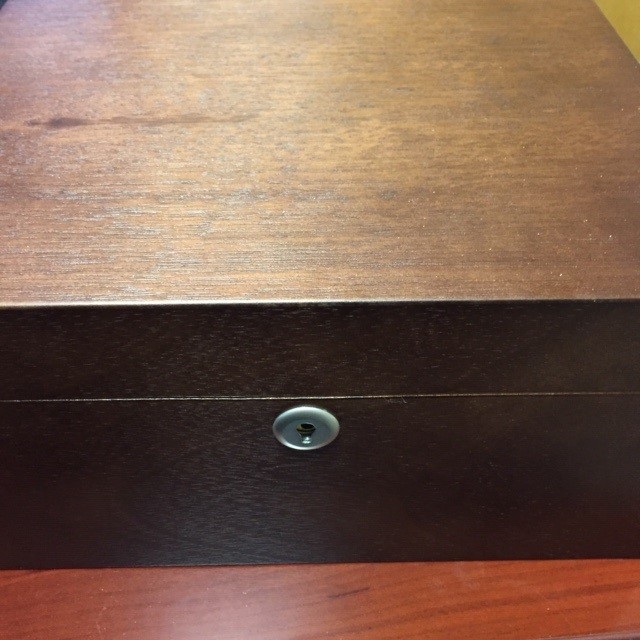
The image size is (640, 640). Identify the location of wooden surface. (332, 604).